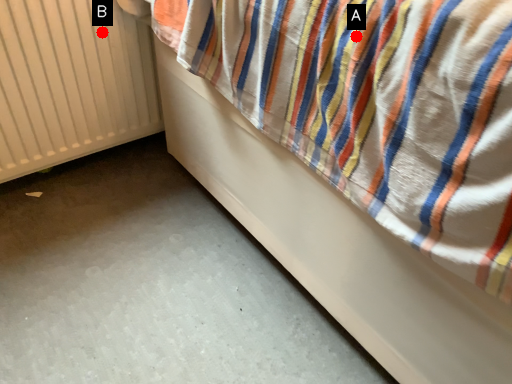
Question: Two points are circled on the image, labeled by A and B beside each circle. Which point is farther to the camera?

Choices:
 (A) A is further
 (B) B is further

Answer: (B)